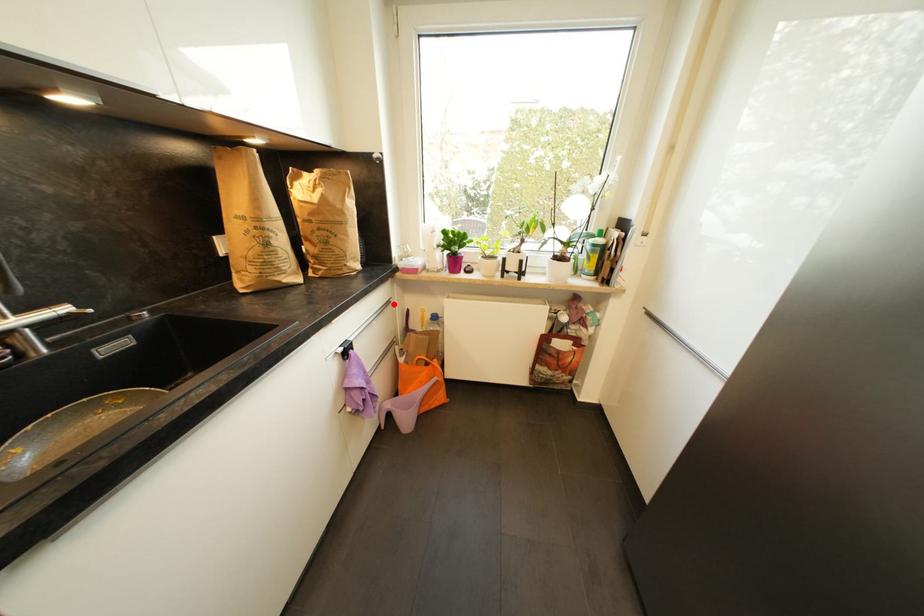
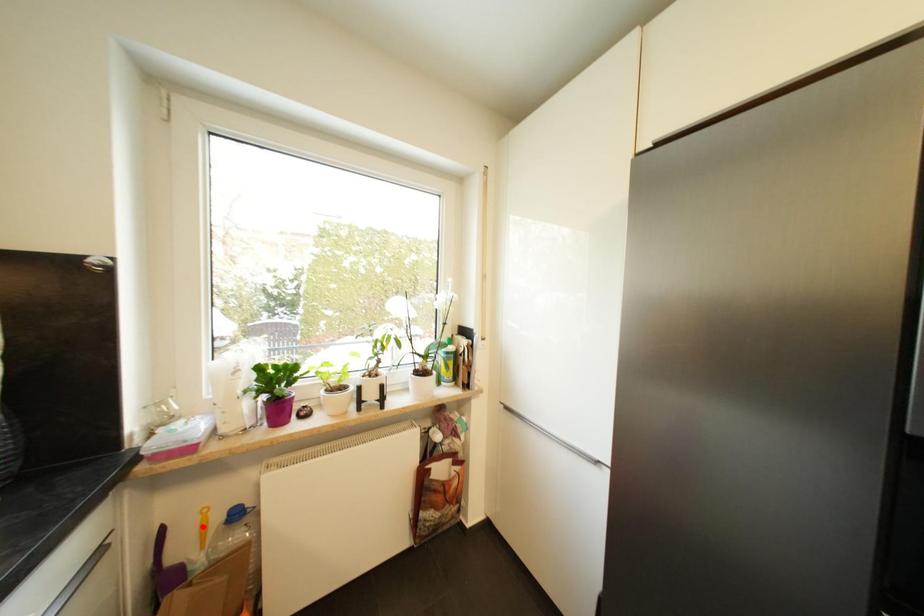
I am providing you with two images of the same scene from different viewpoints. A red point is marked on the first image and another point is marked on the second image. Is the red point in image1 aligned with the point shown in image2?

No